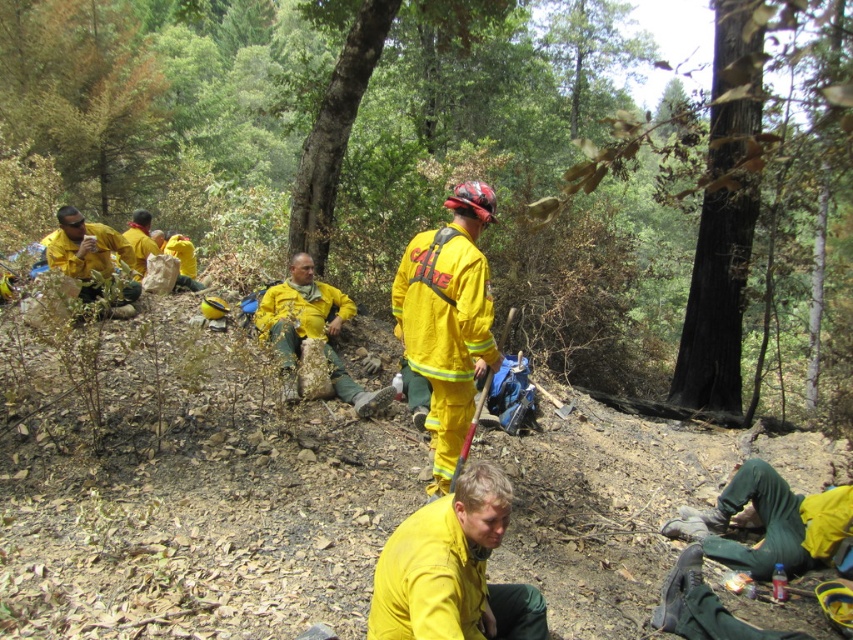
Question: Can you confirm if yellow matte uniform at lower center is positioned above yellow reflective uniform at center?

Choices:
 (A) no
 (B) yes

Answer: (A)

Question: Which object is closer to the camera taking this photo?

Choices:
 (A) yellow reflective uniform at center
 (B) yellow matte uniform at center
 (C) yellow fabric uniform at center
 (D) yellow matte uniform at lower center

Answer: (C)

Question: Is yellow matte uniform at center smaller than yellow reflective uniform at center?

Choices:
 (A) yes
 (B) no

Answer: (A)

Question: Which point is farther to the camera?

Choices:
 (A) (68, 40)
 (B) (312, 301)

Answer: (A)

Question: Is yellow matte uniform at lower center positioned behind yellow matte uniform at center?

Choices:
 (A) no
 (B) yes

Answer: (A)

Question: Among these objects, which one is nearest to the camera?

Choices:
 (A) yellow matte uniform at center
 (B) yellow fabric uniform at center
 (C) yellow reflective uniform at center

Answer: (B)